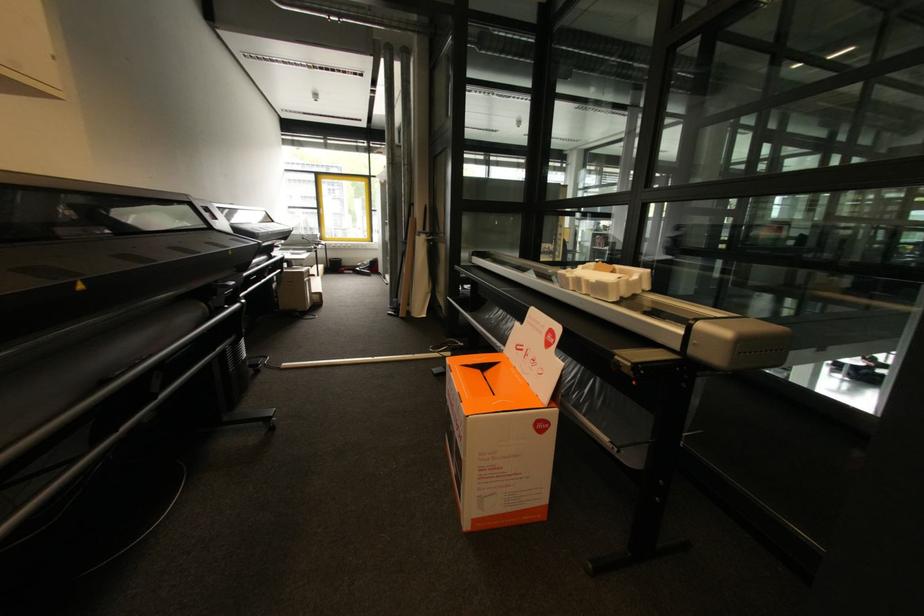
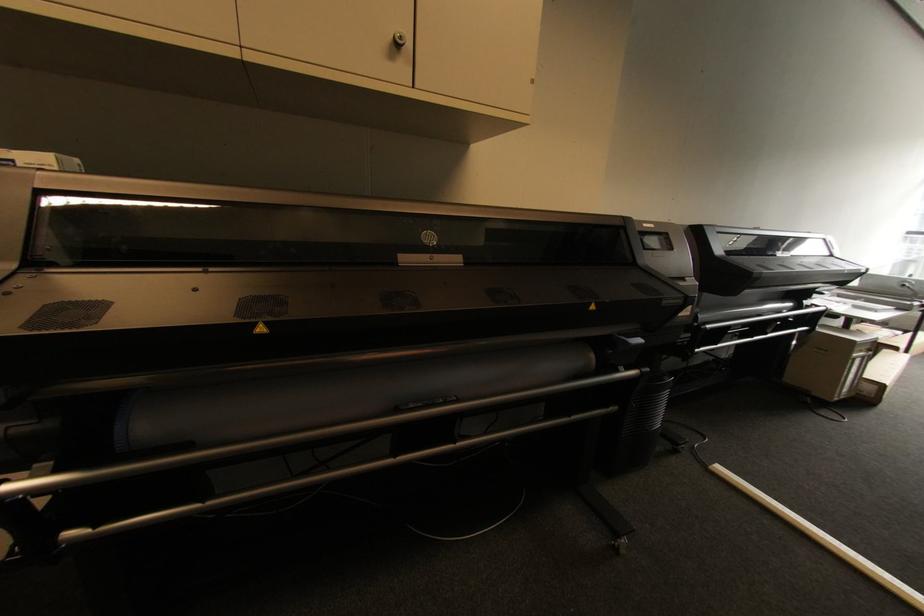
Where in the second image is the point corresponding to (x=276, y=223) from the first image?

(834, 256)